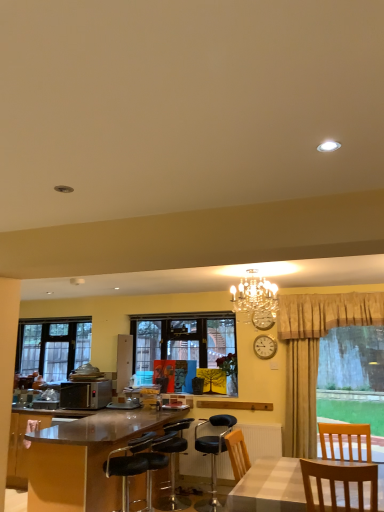
Question: From a real-world perspective, is wooden chair at center below clear glass window at left, positioned as the second window in front-to-back order?

Choices:
 (A) no
 (B) yes

Answer: (B)

Question: Considering the relative sizes of wooden chair at center and clear glass window at left, which is counted as the second window, starting from the right, in the image provided, is wooden chair at center bigger than clear glass window at left, which is counted as the second window, starting from the right,?

Choices:
 (A) yes
 (B) no

Answer: (B)

Question: From a real-world perspective, is wooden chair at center physically above clear glass window at left, positioned as the second window in front-to-back order?

Choices:
 (A) yes
 (B) no

Answer: (B)

Question: Is wooden chair at center behind clear glass window at left, which is counted as the first window, starting from the back?

Choices:
 (A) yes
 (B) no

Answer: (B)

Question: Is wooden chair at center outside clear glass window at left, which is counted as the second window, starting from the right?

Choices:
 (A) yes
 (B) no

Answer: (A)

Question: Can you confirm if wooden chair at center is taller than clear glass window at left, which is counted as the first window, starting from the back?

Choices:
 (A) yes
 (B) no

Answer: (B)

Question: Considering the relative sizes of black leather bar stool at lower left, the 2th chair when ordered from back to front, and shiny brown desk at lower left in the image provided, is black leather bar stool at lower left, the 2th chair when ordered from back to front, shorter than shiny brown desk at lower left?

Choices:
 (A) no
 (B) yes

Answer: (B)

Question: Could you tell me if black leather bar stool at lower left, placed as the third chair when sorted from right to left, is turned towards shiny brown desk at lower left?

Choices:
 (A) yes
 (B) no

Answer: (A)

Question: Is black leather bar stool at lower left, which is the second chair from front to back, completely or partially outside of shiny brown desk at lower left?

Choices:
 (A) no
 (B) yes

Answer: (A)

Question: Can you confirm if black leather bar stool at lower left, which is the second chair from front to back, is thinner than shiny brown desk at lower left?

Choices:
 (A) yes
 (B) no

Answer: (A)

Question: Does black leather bar stool at lower left, which is the second chair from front to back, have a smaller size compared to shiny brown desk at lower left?

Choices:
 (A) no
 (B) yes

Answer: (B)

Question: From the image's perspective, is black leather bar stool at lower left, which is the second chair from front to back, below shiny brown desk at lower left?

Choices:
 (A) yes
 (B) no

Answer: (B)

Question: Is black leather bar stool at center, the first chair from the back, inside clear glass window at left, which is counted as the second window, starting from the right?

Choices:
 (A) no
 (B) yes

Answer: (A)